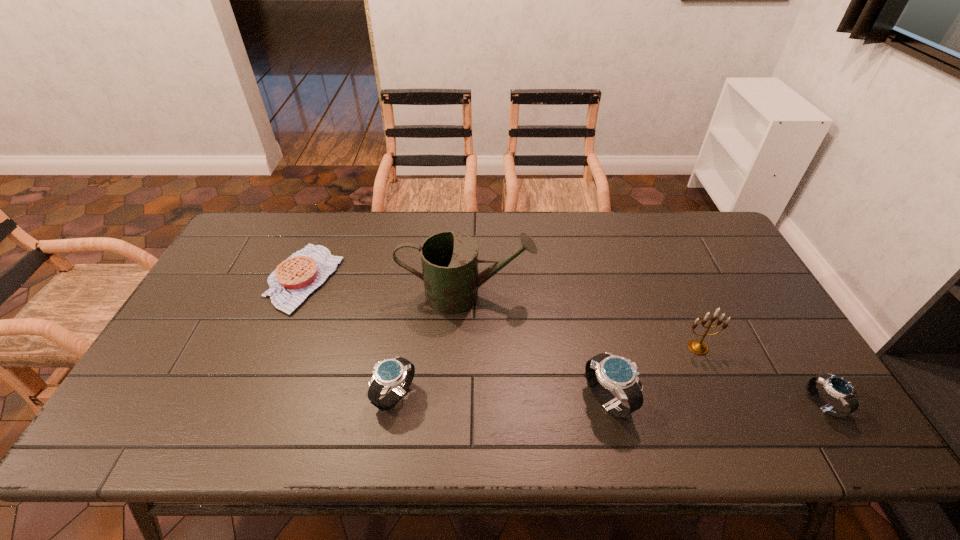
Image resolution: width=960 pixels, height=540 pixels. Find the location of `the second shortest watch`. the second shortest watch is located at coordinates coord(397,373).

You are a GUI agent. You are given a task and a screenshot of the screen. Output one action in this format:
    pyautogui.click(x=<x>, y=<y>)
    Task: Click on the leftmost watch
    
    Given the screenshot: What is the action you would take?
    pyautogui.click(x=397, y=373)

Locate an element on the screen. the fourth shortest object is located at coordinates (606, 371).

At what (x,y) coordinates should I click in order to perform the action: click on the second watch from left to right. Please return your answer as a coordinate pair (x, y). Looking at the image, I should click on (606, 371).

This screenshot has width=960, height=540. Identify the location of the rightmost watch. (838, 387).

Where is `the fifth tallest object`? The image size is (960, 540). the fifth tallest object is located at coordinates (838, 387).

Find the location of a particular element. the second tallest object is located at coordinates click(698, 347).

The width and height of the screenshot is (960, 540). I want to click on the second object from right to left, so click(x=698, y=347).

This screenshot has height=540, width=960. In order to click on watering can in this screenshot , I will do `click(449, 259)`.

At what (x,y) coordinates should I click in order to perform the action: click on pie. Please return your answer as a coordinate pair (x, y). The width and height of the screenshot is (960, 540). Looking at the image, I should click on (292, 281).